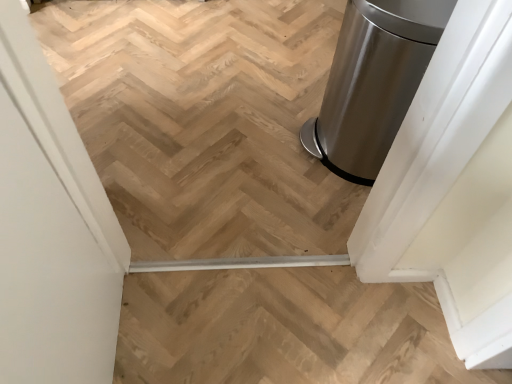
Question: From a real-world perspective, is natural wood stairs at center physically located above or below satin silver trash can at right?

Choices:
 (A) above
 (B) below

Answer: (B)

Question: Which is correct: natural wood stairs at center is inside satin silver trash can at right, or outside of it?

Choices:
 (A) outside
 (B) inside

Answer: (A)

Question: Which object is the farthest from the satin metallic trash can at right?

Choices:
 (A) satin silver trash can at right
 (B) natural wood stairs at center
 (C) white matte screen door at left

Answer: (C)

Question: Based on their relative distances, which object is nearer to the natural wood stairs at center?

Choices:
 (A) white matte screen door at left
 (B) satin metallic trash can at right
 (C) satin silver trash can at right

Answer: (A)